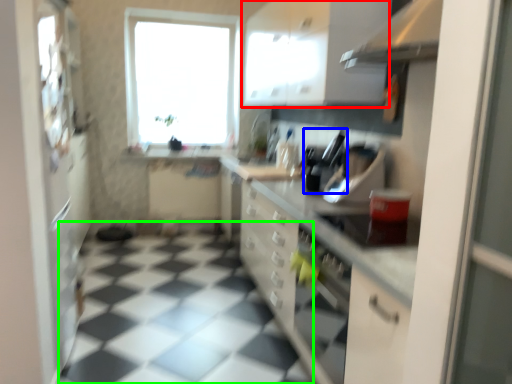
Question: Which object is the farthest from cabinetry (highlighted by a red box)? Choose among these: appliance (highlighted by a blue box) or tile (highlighted by a green box).

Choices:
 (A) appliance
 (B) tile

Answer: (B)